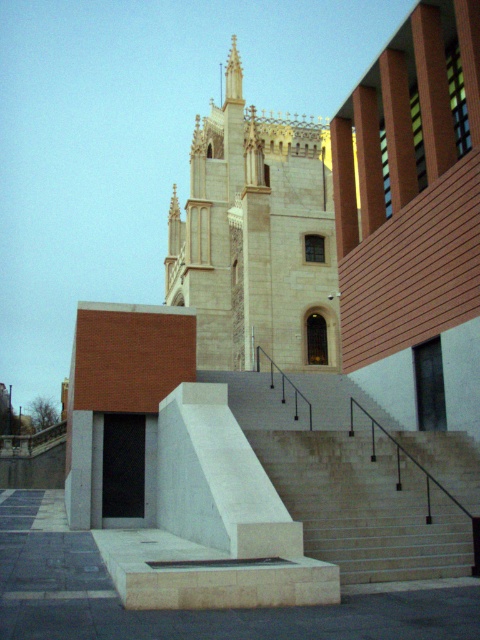
You are an architect visiting the site and want to take a photo that captures both the light beige stone tower at center and the white marble stairs at center. Which object should you focus on first to ensure it appears larger in your photo?

The light beige stone tower at center is taller than the white marble stairs at center, so focusing on it first will ensure it appears larger in the photo.

You are standing at the base of the white marble stairs at center and want to reach the entrance of the light beige stone tower at center. Based on the scene description, what direction should you move in to ascend towards the tower?

The light beige stone tower at center is above the white marble stairs at center, so you should move upward along the white marble stairs at center to ascend towards the tower.